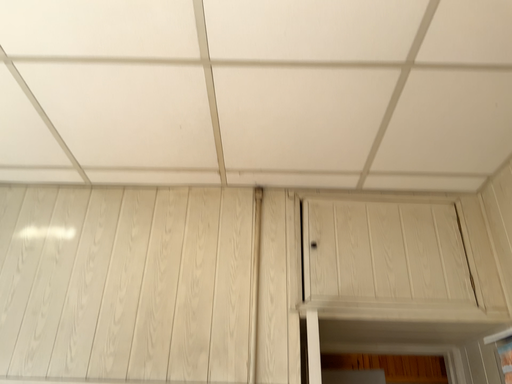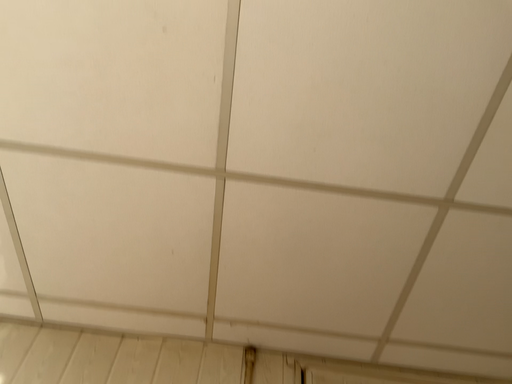
Question: Which way did the camera rotate in the video?

Choices:
 (A) rotated upward
 (B) rotated downward

Answer: (A)